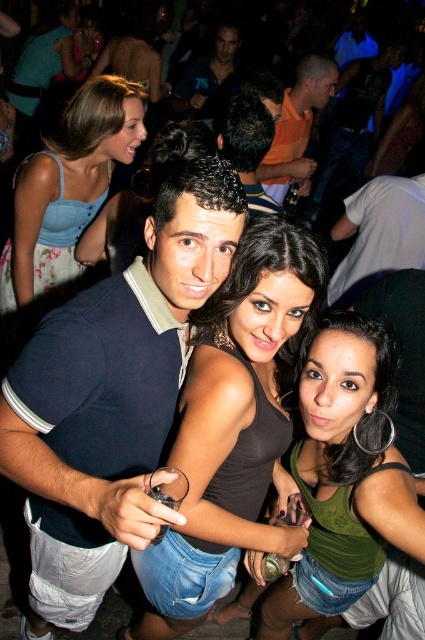
You are a photographer trying to capture a clear shot of the dark blue shirt at center and the white cotton shirt at upper right. Which of the two shirts is closer to the camera?

The dark blue shirt at center is closer to the camera because the white cotton shirt at upper right is positioned under it.

Looking at this image, you are taking a photo of two people in a nightclub scene. You see a white cotton shirt at upper right and a dark blue shirt at center. Which shirt is located to the right of the other?

The white cotton shirt at upper right is positioned on the right side of dark blue shirt at center.